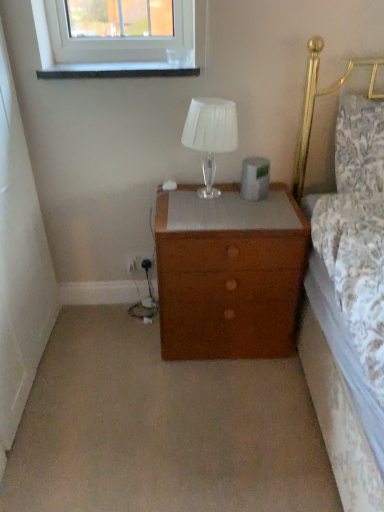
This screenshot has width=384, height=512. What are the coordinates of `vacant space in front of translucent glass table lamp at upper center` in the screenshot? It's located at (203, 209).